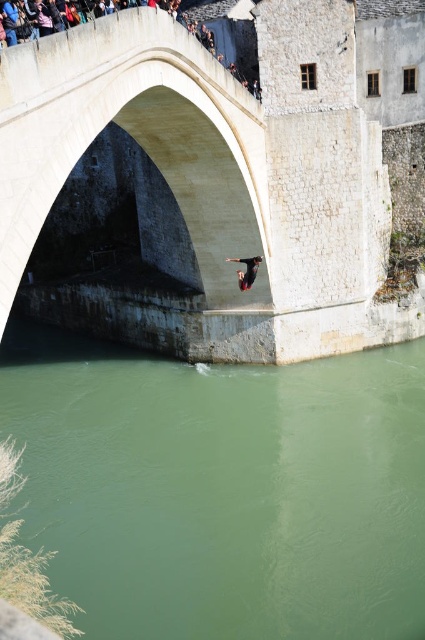
You are standing at the point closer to the camera in the image. Which point are you at, point (110, 474) or point (299, 280)?

You are at point (110, 474) because it is in front of point (299, 280), meaning it is closer to the viewer.

You are a tourist standing on the white stone arch bridge at center and want to take a photo of the green smooth water at center. Since the bridge is narrow, will the entire water surface fit in your camera frame if you position yourself in the middle of the bridge?

The green smooth water at center is wider than the white stone arch bridge at center, so when positioned in the middle, the entire water surface can fit in your camera frame because the water is wider than the bridge.

You are standing on the white stone arch bridge at center and want to see the green smooth water at center. In which direction should you look from the bridge?

You should look to the left from the white stone arch bridge at center to see the green smooth water at center, as it is positioned to the left of the bridge.